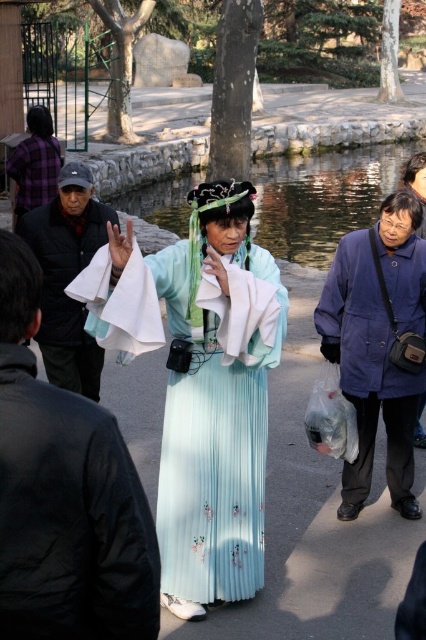
You are standing at the center of the paved path in the park scene. There are two points marked in the image, one at coordinates point (x=209, y=552) and another at point (x=55, y=156). Which of these points is nearer to your current position?

Point (x=209, y=552) is closer to the viewer than point (x=55, y=156), so the point at coordinates point (x=209, y=552) is nearer to your current position.

You are a fashion designer observing the scene. You need to determine which item of clothing is wider between the dark gray fabric jacket at left and the light blue silk skirt at center. Which one is wider?

The dark gray fabric jacket at left is wider than the light blue silk skirt at center according to the description.

You are standing at the point with coordinates point (63,300) and want to move to the point with coordinates point (342,266). Which direction should you move to reach your destination?

You should move forward because point (342,266) is in front of point (63,300).